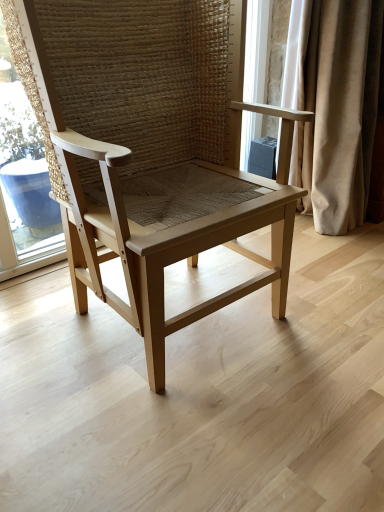
Identify the location of vacant region under light wood chair at center (from a real-world perspective). The image size is (384, 512). (182, 308).